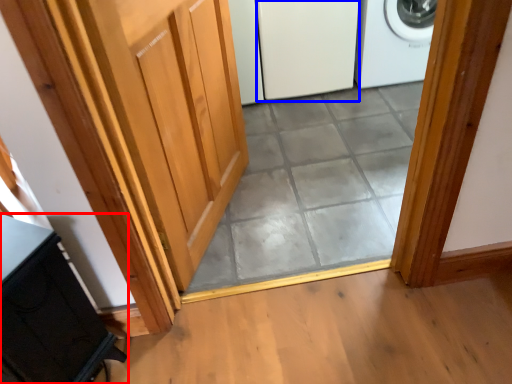
Question: Among these objects, which one is nearest to the camera, cabinetry (highlighted by a red box) or screen door (highlighted by a blue box)?

Choices:
 (A) cabinetry
 (B) screen door

Answer: (A)